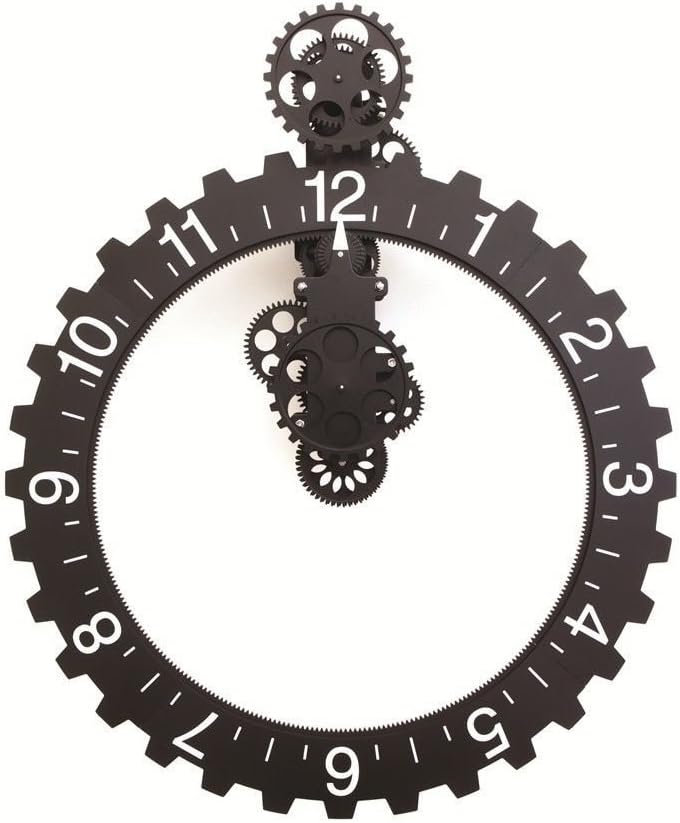
Locate an element on the screen. background bottom left of clock is located at coordinates (49, 787).